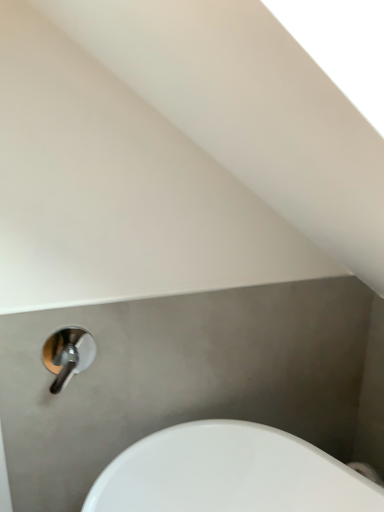
Question: Is white glossy sink at lower left surrounded by polished chrome tap at lower left?

Choices:
 (A) yes
 (B) no

Answer: (B)

Question: From the image's perspective, is polished chrome tap at lower left under white glossy sink at lower left?

Choices:
 (A) yes
 (B) no

Answer: (B)

Question: From a real-world perspective, is polished chrome tap at lower left located beneath white glossy sink at lower left?

Choices:
 (A) yes
 (B) no

Answer: (B)

Question: Considering the relative sizes of polished chrome tap at lower left and white glossy sink at lower left in the image provided, is polished chrome tap at lower left thinner than white glossy sink at lower left?

Choices:
 (A) yes
 (B) no

Answer: (A)

Question: Is polished chrome tap at lower left facing towards white glossy sink at lower left?

Choices:
 (A) yes
 (B) no

Answer: (B)

Question: Does polished chrome tap at lower left have a lesser height compared to white glossy sink at lower left?

Choices:
 (A) yes
 (B) no

Answer: (A)

Question: From a real-world perspective, is white glossy sink at lower left on top of polished chrome tap at lower left?

Choices:
 (A) yes
 (B) no

Answer: (B)

Question: Can you see white glossy sink at lower left touching polished chrome tap at lower left?

Choices:
 (A) yes
 (B) no

Answer: (B)

Question: Is white glossy sink at lower left closer to camera compared to polished chrome tap at lower left?

Choices:
 (A) no
 (B) yes

Answer: (B)

Question: Is white glossy sink at lower left outside of polished chrome tap at lower left?

Choices:
 (A) no
 (B) yes

Answer: (B)

Question: Is white glossy sink at lower left positioned behind polished chrome tap at lower left?

Choices:
 (A) no
 (B) yes

Answer: (A)

Question: Is white glossy sink at lower left thinner than polished chrome tap at lower left?

Choices:
 (A) yes
 (B) no

Answer: (B)

Question: Considering the positions of polished chrome tap at lower left and white glossy sink at lower left in the image, is polished chrome tap at lower left taller or shorter than white glossy sink at lower left?

Choices:
 (A) short
 (B) tall

Answer: (A)